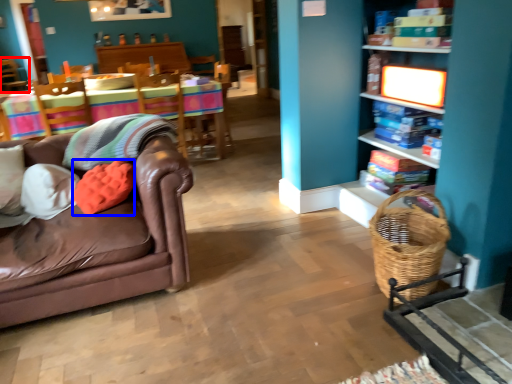
Question: Which object is closer to the camera taking this photo, chair (highlighted by a red box) or pillow (highlighted by a blue box)?

Choices:
 (A) chair
 (B) pillow

Answer: (B)